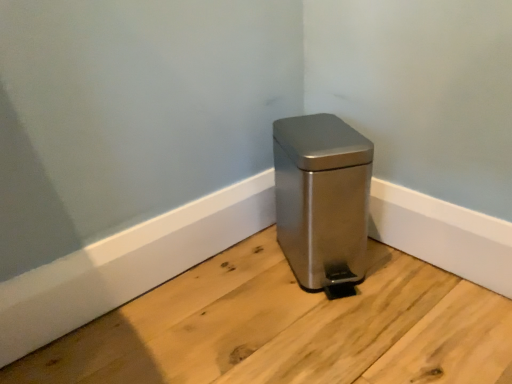
This screenshot has height=384, width=512. I want to click on satin silver trash can at center, so click(322, 200).

Describe the element at coordinates (322, 200) in the screenshot. The height and width of the screenshot is (384, 512). I see `satin silver trash can at center` at that location.

Identify the location of satin silver trash can at center. The width and height of the screenshot is (512, 384). (322, 200).